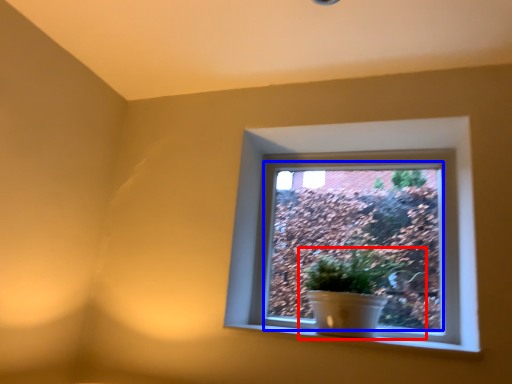
Question: Which object is further to the camera taking this photo, houseplant (highlighted by a red box) or window screen (highlighted by a blue box)?

Choices:
 (A) houseplant
 (B) window screen

Answer: (B)